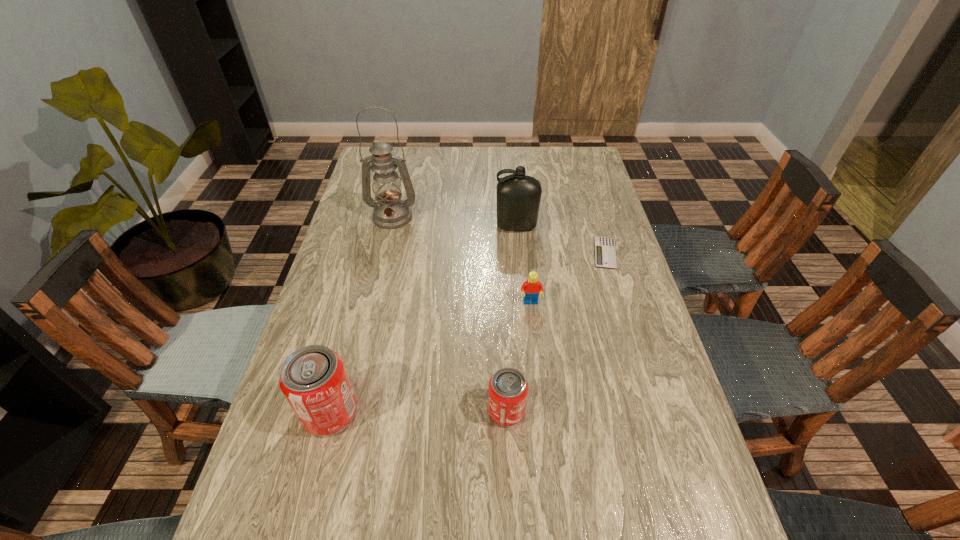
Identify the location of the third tallest object. This screenshot has width=960, height=540. (313, 379).

The height and width of the screenshot is (540, 960). What are the coordinates of `the taller can` in the screenshot? It's located at (313, 379).

What are the coordinates of `the right can` in the screenshot? It's located at (508, 388).

The height and width of the screenshot is (540, 960). Find the location of `oil lamp`. oil lamp is located at coordinates (390, 212).

Identify the location of the second tallest object. 518,196.

Find the location of a particular element. This screenshot has height=540, width=960. the rightmost object is located at coordinates (605, 253).

The width and height of the screenshot is (960, 540). Identify the location of calculator. (605, 253).

You are a GUI agent. You are given a task and a screenshot of the screen. Output one action in this format:
    pyautogui.click(x=<x>, y=<y>)
    Task: Click on the fourth farthest object
    This screenshot has height=540, width=960.
    Given the screenshot: What is the action you would take?
    pyautogui.click(x=532, y=287)

At what (x,y) coordinates should I click in order to perform the action: click on vacant space located on the front of the third tallest object. Please return your answer as a coordinate pair (x, y). This screenshot has height=540, width=960. Looking at the image, I should click on (312, 482).

Where is `free region located 0.170m on the back of the right can`? The image size is (960, 540). free region located 0.170m on the back of the right can is located at coordinates (503, 336).